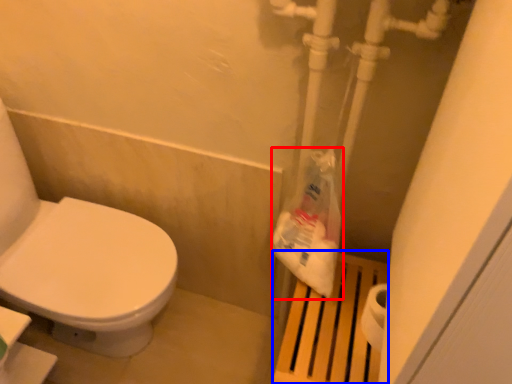
Question: Which of the following is the farthest to the observer, paper bag (highlighted by a red box) or step stool (highlighted by a blue box)?

Choices:
 (A) paper bag
 (B) step stool

Answer: (B)